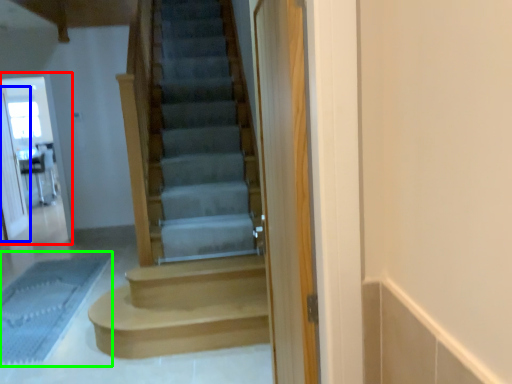
Question: Which is nearer to the screen door (highlighted by a red box)? screen door (highlighted by a blue box) or bath mat (highlighted by a green box).

Choices:
 (A) screen door
 (B) bath mat

Answer: (A)